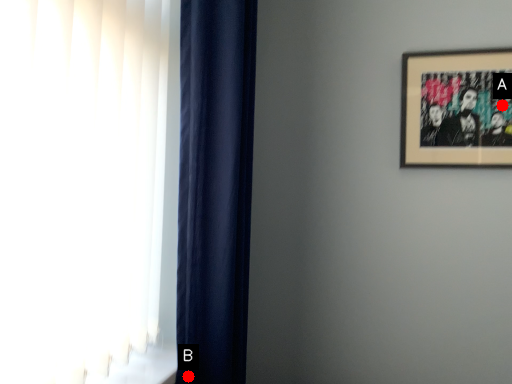
Question: Two points are circled on the image, labeled by A and B beside each circle. Which point is farther to the camera?

Choices:
 (A) A is further
 (B) B is further

Answer: (A)